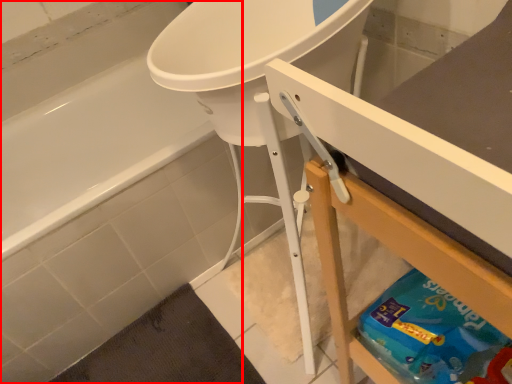
Question: From the image, what is the correct spatial relationship of bathtub (annotated by the red box) in relation to counter?

Choices:
 (A) right
 (B) left

Answer: (B)